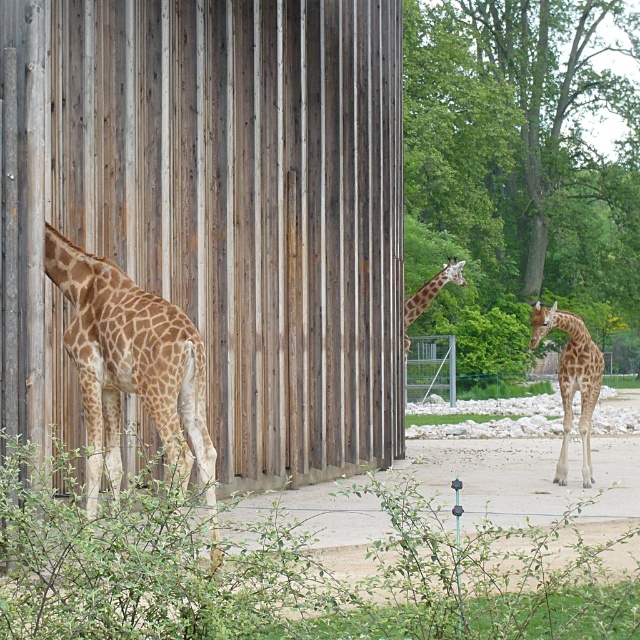
Between spotted fur giraffe at left and spotted fur giraffe at center, which one appears on the right side from the viewer's perspective?

From the viewer's perspective, spotted fur giraffe at center appears more on the right side.

Does spotted fur giraffe at left appear over spotted fur giraffe at center?

Indeed, spotted fur giraffe at left is positioned over spotted fur giraffe at center.

Describe the element at coordinates (132, 368) in the screenshot. I see `spotted fur giraffe at left` at that location.

At what (x,y) coordinates should I click in order to perform the action: click on spotted fur giraffe at left. Please return your answer as a coordinate pair (x, y). Image resolution: width=640 pixels, height=640 pixels. Looking at the image, I should click on (132, 368).

Between spotted fur giraffe at right and spotted fur giraffe at center, which one appears on the left side from the viewer's perspective?

Positioned to the left is spotted fur giraffe at center.

Is spotted fur giraffe at right below spotted fur giraffe at center?

Yes, spotted fur giraffe at right is below spotted fur giraffe at center.

Is point (532, 337) positioned behind point (442, 268)?

No, (532, 337) is in front of (442, 268).

Identify the location of spotted fur giraffe at right. The height and width of the screenshot is (640, 640). coord(572,378).

Does point (211, 547) come closer to viewer compared to point (582, 420)?

Yes, it is.

Can you confirm if spotted fur giraffe at left is positioned to the right of spotted fur giraffe at right?

In fact, spotted fur giraffe at left is to the left of spotted fur giraffe at right.

I want to click on spotted fur giraffe at left, so click(x=132, y=368).

Where is `spotted fur giraffe at left`? spotted fur giraffe at left is located at coordinates (132, 368).